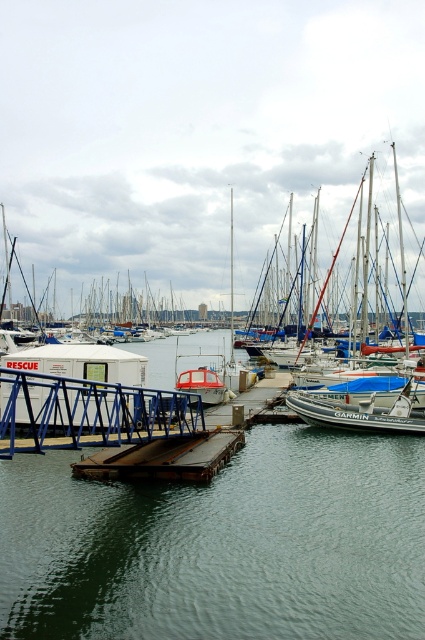
You are standing at the rescue hut near the gangway and want to walk to the dock. There are two points marked on the dock, point 1 at coordinates point (252,557) and point 2 at coordinates point (99,474). Which point should you head towards if you want to reach the one closer to the shore?

Point (99,474) is closer to the shore because it is behind point (252,557), which is further away from the rescue hut.

You are standing on the shore and see the green water at center and the rusty metal dock at center. Which object is closer to your left side?

The green water at center is positioned on the left side of rusty metal dock at center, so the green water at center is closer to your left side.